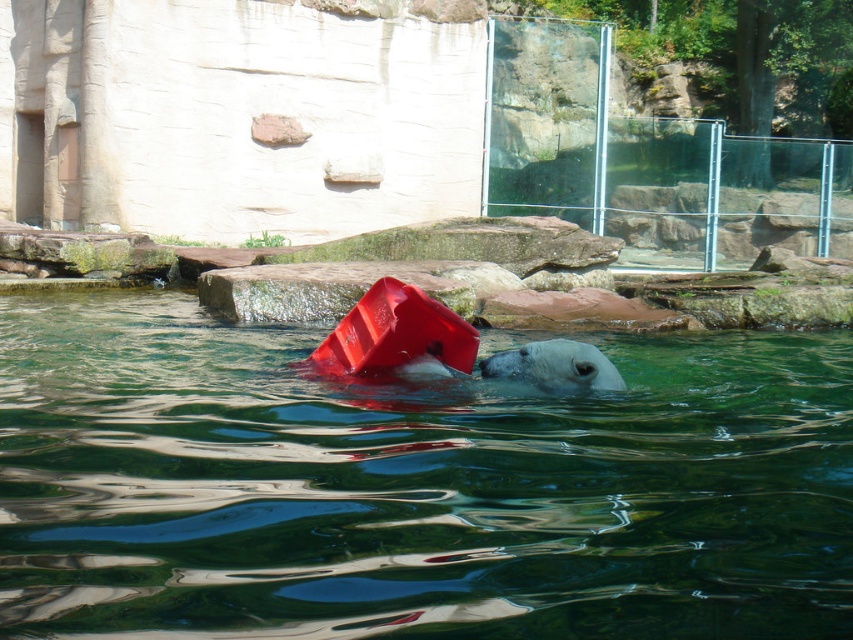
Locate an element on the screen. Image resolution: width=853 pixels, height=640 pixels. smooth plastic pool at center is located at coordinates (412, 486).

Locate an element on the screen. The height and width of the screenshot is (640, 853). smooth plastic pool at center is located at coordinates (412, 486).